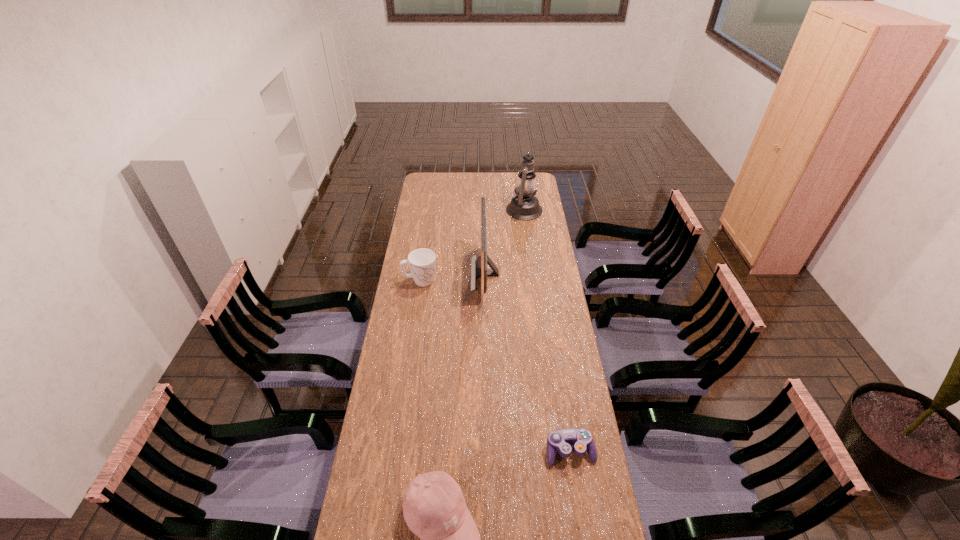
Locate an element on the screen. vacant region located on the side of the mug with the handle is located at coordinates (493, 281).

At what (x,y) coordinates should I click in order to perform the action: click on vacant space located 0.220m on the back of the second nearest object. Please return your answer as a coordinate pair (x, y). Looking at the image, I should click on (559, 380).

Locate an element on the screen. The width and height of the screenshot is (960, 540). object located in the left edge section of the desktop is located at coordinates (422, 262).

At what (x,y) coordinates should I click in order to perform the action: click on oil lamp that is at the right edge. Please return your answer as a coordinate pair (x, y). This screenshot has height=540, width=960. Looking at the image, I should click on (524, 205).

Where is `control located at the right edge`? The image size is (960, 540). control located at the right edge is located at coordinates (560, 440).

The width and height of the screenshot is (960, 540). I want to click on free space at the left edge of the desktop, so click(409, 426).

This screenshot has height=540, width=960. I want to click on vacant region at the right edge of the desktop, so click(x=558, y=535).

The width and height of the screenshot is (960, 540). Find the location of `unoccupied area between the second tallest object and the control`. unoccupied area between the second tallest object and the control is located at coordinates (527, 362).

Where is `unoccupied position between the control and the mug`? The width and height of the screenshot is (960, 540). unoccupied position between the control and the mug is located at coordinates (494, 366).

This screenshot has height=540, width=960. What are the coordinates of `unoccupied area between the control and the farthest object` in the screenshot? It's located at pos(545,330).